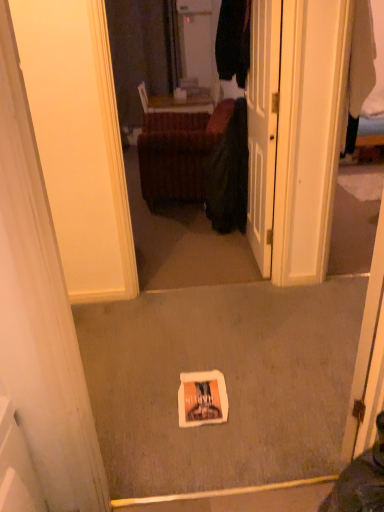
Question: Is velvet brown ottoman at center behind dark green fabric at center?

Choices:
 (A) yes
 (B) no

Answer: (A)

Question: Considering the relative sizes of velvet brown ottoman at center and dark green fabric at center in the image provided, is velvet brown ottoman at center wider than dark green fabric at center?

Choices:
 (A) no
 (B) yes

Answer: (B)

Question: Is velvet brown ottoman at center directly adjacent to dark green fabric at center?

Choices:
 (A) yes
 (B) no

Answer: (B)

Question: Is velvet brown ottoman at center outside of dark green fabric at center?

Choices:
 (A) no
 (B) yes

Answer: (B)

Question: Considering the relative sizes of velvet brown ottoman at center and dark green fabric at center in the image provided, is velvet brown ottoman at center bigger than dark green fabric at center?

Choices:
 (A) no
 (B) yes

Answer: (B)

Question: Relative to white glossy door at center, is dark green fabric at center in front or behind?

Choices:
 (A) behind
 (B) front

Answer: (A)

Question: Is dark green fabric at center spatially inside white glossy door at center, or outside of it?

Choices:
 (A) outside
 (B) inside

Answer: (A)

Question: From a real-world perspective, relative to white glossy door at center, is dark green fabric at center vertically above or below?

Choices:
 (A) above
 (B) below

Answer: (B)

Question: From the image's perspective, is dark green fabric at center positioned above or below white glossy door at center?

Choices:
 (A) above
 (B) below

Answer: (B)

Question: From the image's perspective, is velvet brown ottoman at center positioned above or below white glossy door at center?

Choices:
 (A) below
 (B) above

Answer: (B)

Question: From their relative heights in the image, would you say velvet brown ottoman at center is taller or shorter than white glossy door at center?

Choices:
 (A) tall
 (B) short

Answer: (B)

Question: Looking at the image, does velvet brown ottoman at center seem bigger or smaller compared to white glossy door at center?

Choices:
 (A) small
 (B) big

Answer: (B)

Question: Is point (140, 138) positioned closer to the camera than point (251, 125)?

Choices:
 (A) closer
 (B) farther

Answer: (B)

Question: In terms of height, does white glossy door at center look taller or shorter compared to velvet brown ottoman at center?

Choices:
 (A) tall
 (B) short

Answer: (A)

Question: From a real-world perspective, relative to velvet brown ottoman at center, is white glossy door at center vertically above or below?

Choices:
 (A) above
 (B) below

Answer: (A)